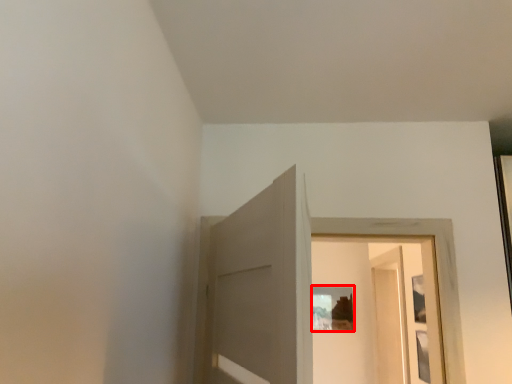
Question: From the image, what is the correct spatial relationship of picture frame (annotated by the red box) in relation to screen door?

Choices:
 (A) left
 (B) right

Answer: (A)